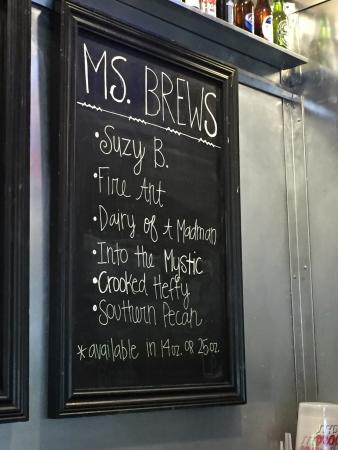
You are a GUI agent. You are given a task and a screenshot of the screen. Output one action in this format:
    pyautogui.click(x=<x>, y=<y>)
    Task: Click on the frame
    
    Given the screenshot: What is the action you would take?
    pyautogui.click(x=19, y=30), pyautogui.click(x=13, y=421), pyautogui.click(x=21, y=314), pyautogui.click(x=57, y=327), pyautogui.click(x=147, y=402), pyautogui.click(x=233, y=266), pyautogui.click(x=152, y=42)